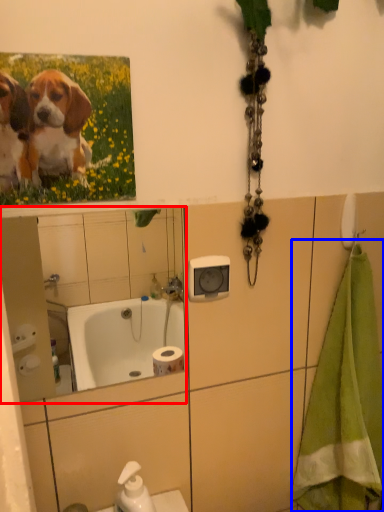
Question: Which of the following is the closest to the observer, mirror (highlighted by a red box) or bath towel (highlighted by a blue box)?

Choices:
 (A) mirror
 (B) bath towel

Answer: (A)